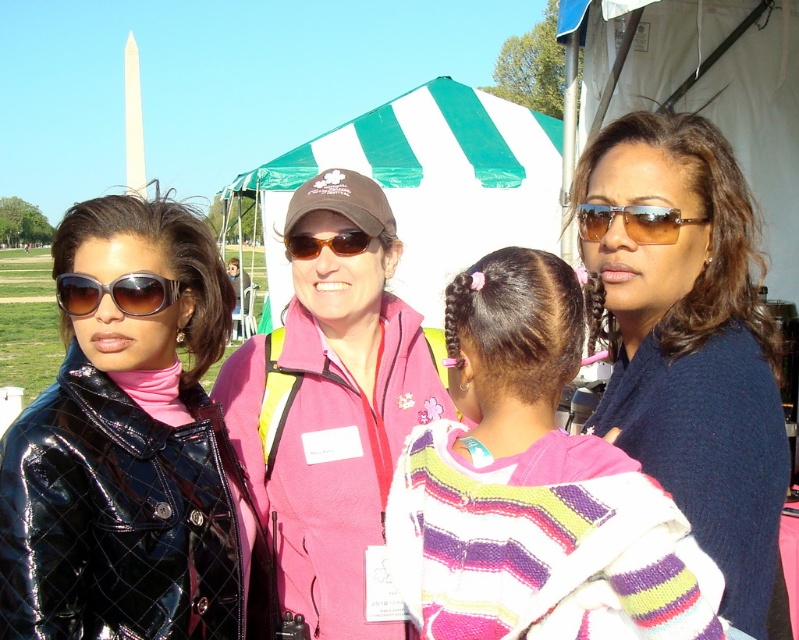
Question: Which point is closer to the camera?

Choices:
 (A) (567, 280)
 (B) (90, 292)
 (C) (372, 449)
 (D) (352, 252)

Answer: (A)

Question: Does matte blue sweater at center have a smaller size compared to matte brown sunglasses at right?

Choices:
 (A) yes
 (B) no

Answer: (B)

Question: Which object is the farthest from the matte blue sweater at center?

Choices:
 (A) green striped canopy at center
 (B) matte black sunglasses at left
 (C) matte brown sunglasses at right

Answer: (A)

Question: In this image, where is glossy black jacket at center located relative to green striped canopy at center?

Choices:
 (A) right
 (B) left

Answer: (B)

Question: From the image, what is the correct spatial relationship of striped knit sweater at center in relation to white fabric canopy at upper center?

Choices:
 (A) above
 (B) below

Answer: (B)

Question: Which of these objects is positioned farthest from the white fabric canopy at upper center?

Choices:
 (A) matte blue sweater at center
 (B) matte brown sunglasses at center
 (C) matte brown sunglasses at right

Answer: (C)